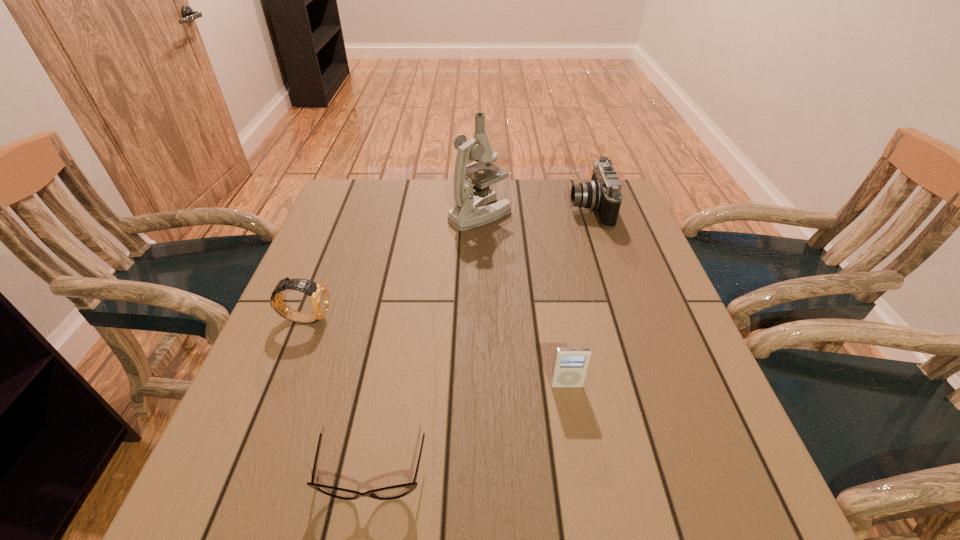
The image size is (960, 540). What are the coordinates of `microscope` in the screenshot? It's located at 472,208.

This screenshot has width=960, height=540. I want to click on the second tallest object, so click(602, 195).

I want to click on the rightmost object, so click(602, 195).

Where is `the third nearest object`? the third nearest object is located at coordinates (319, 297).

Locate an element on the screen. the leftmost object is located at coordinates (319, 297).

Locate an element on the screen. Image resolution: width=960 pixels, height=540 pixels. the fourth object from left to right is located at coordinates (570, 366).

Identify the location of iPod. (570, 366).

Locate an element on the screen. The height and width of the screenshot is (540, 960). the nearest object is located at coordinates (397, 491).

Image resolution: width=960 pixels, height=540 pixels. I want to click on the shortest object, so point(397,491).

Identify the location of blank space located on the right of the microscope. Image resolution: width=960 pixels, height=540 pixels. (560, 214).